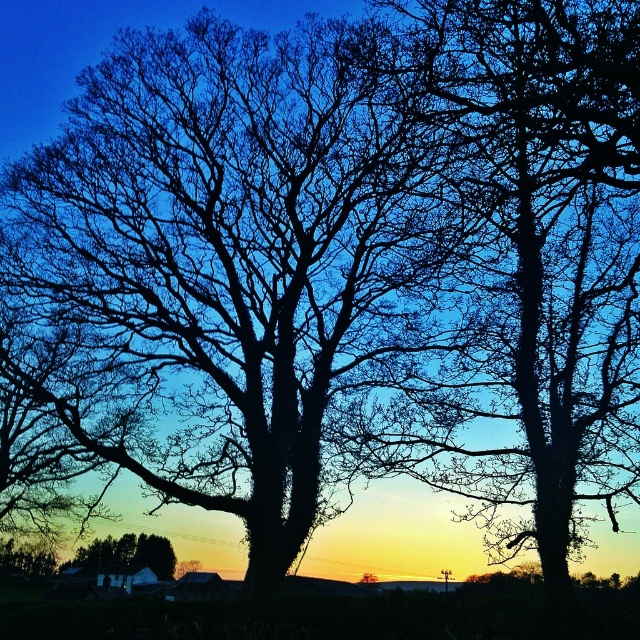
You are a photographer planning to take a photo of the smooth brown house at lower center without the silhouette bark tree at center blocking it. What adjustment should you make to your camera angle?

To avoid the silhouette bark tree at center blocking the smooth brown house at lower center, you should lower your camera angle since the tree is positioned above the house.

You are a photographer setting up a tripod to capture the silhouette bark tree at center and the smooth brown house at lower center. Based on their heights, which one will appear larger in the photo?

The silhouette bark tree at center is taller than the smooth brown house at lower center, so it will appear larger in the photo.